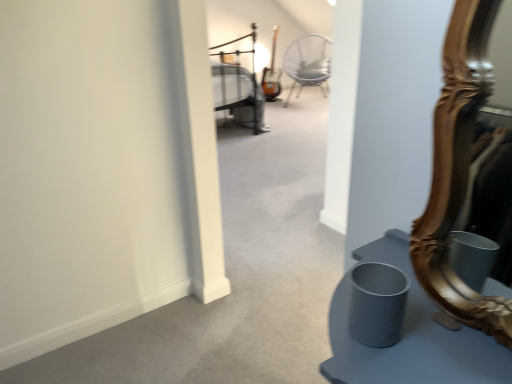
Question: From a real-world perspective, is metallic silver bed at upper center on top of metallic silver chair at center?

Choices:
 (A) no
 (B) yes

Answer: (B)

Question: From the image's perspective, is metallic silver bed at upper center on metallic silver chair at center?

Choices:
 (A) yes
 (B) no

Answer: (B)

Question: Considering the relative sizes of metallic silver bed at upper center and metallic silver chair at center in the image provided, is metallic silver bed at upper center thinner than metallic silver chair at center?

Choices:
 (A) yes
 (B) no

Answer: (B)

Question: Is the position of metallic silver bed at upper center less distant than that of metallic silver chair at center?

Choices:
 (A) yes
 (B) no

Answer: (A)

Question: Does metallic silver bed at upper center have a greater height compared to metallic silver chair at center?

Choices:
 (A) yes
 (B) no

Answer: (A)

Question: Would you say metallic silver chair at center is inside or outside metallic silver bed at upper center?

Choices:
 (A) outside
 (B) inside

Answer: (A)

Question: From a real-world perspective, relative to metallic silver bed at upper center, is metallic silver chair at center vertically above or below?

Choices:
 (A) below
 (B) above

Answer: (A)

Question: Relative to metallic silver bed at upper center, is metallic silver chair at center in front or behind?

Choices:
 (A) behind
 (B) front

Answer: (A)

Question: Considering the positions of point (294, 51) and point (219, 59), is point (294, 51) closer or farther from the camera than point (219, 59)?

Choices:
 (A) farther
 (B) closer

Answer: (A)

Question: In terms of height, does metallic silver bed at upper center look taller or shorter compared to metallic silver chair at center?

Choices:
 (A) tall
 (B) short

Answer: (A)

Question: Based on their positions, is metallic silver bed at upper center located to the left or right of metallic silver chair at center?

Choices:
 (A) left
 (B) right

Answer: (A)

Question: Is metallic silver bed at upper center bigger or smaller than metallic silver chair at center?

Choices:
 (A) big
 (B) small

Answer: (A)

Question: Considering their positions, is metallic silver bed at upper center located in front of or behind metallic silver chair at center?

Choices:
 (A) front
 (B) behind

Answer: (A)

Question: Looking at the image, does gold carved mirror at right seem bigger or smaller compared to metallic silver bed at upper center?

Choices:
 (A) big
 (B) small

Answer: (B)

Question: From their relative heights in the image, would you say gold carved mirror at right is taller or shorter than metallic silver bed at upper center?

Choices:
 (A) short
 (B) tall

Answer: (A)